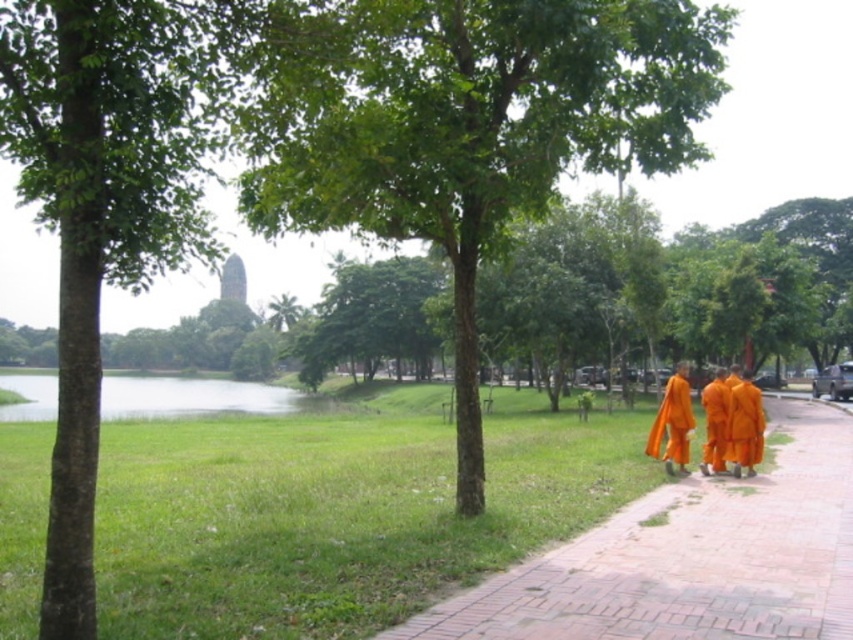
Question: Which point is closer to the camera?

Choices:
 (A) orange cloth at lower right
 (B) orange cloth monk at right
 (C) brick pavement at lower right
 (D) green leafy tree at center

Answer: (C)

Question: Can you confirm if brick pavement at lower right is bigger than orange cloth monk at right?

Choices:
 (A) no
 (B) yes

Answer: (B)

Question: Among these objects, which one is nearest to the camera?

Choices:
 (A) orange cloth monk at right
 (B) orange cloth at lower right
 (C) green leafy tree at center

Answer: (C)

Question: Can you confirm if green leafy tree at center is positioned above orange cloth at lower right?

Choices:
 (A) no
 (B) yes

Answer: (B)

Question: Which object appears closest to the camera in this image?

Choices:
 (A) orange cloth at lower right
 (B) green leafy tree at center
 (C) brick pavement at lower right

Answer: (C)

Question: Is green leafy tree at center bigger than orange cloth monk at right?

Choices:
 (A) no
 (B) yes

Answer: (B)